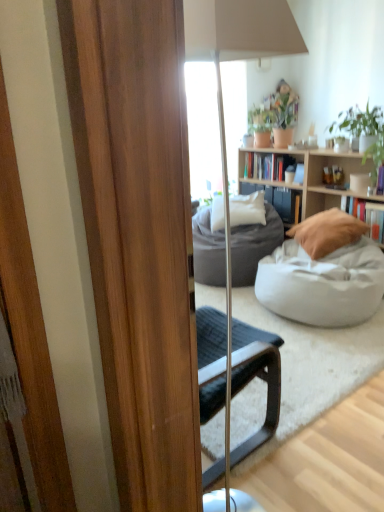
Image resolution: width=384 pixels, height=512 pixels. I want to click on matte beige lamp at center, so pyautogui.click(x=222, y=98).

What do you see at coordinates (366, 215) in the screenshot?
I see `hardcover book at right, which is the second book from back to front` at bounding box center [366, 215].

Describe the element at coordinates (247, 209) in the screenshot. The image size is (384, 512). I see `white soft pillow at center, the 1th pillow in the left-to-right sequence` at that location.

Image resolution: width=384 pixels, height=512 pixels. I want to click on green matte plant at upper right, so point(364,131).

Identify the location of dark gray fabric studio couch at center, the 1th studio couch viewed from the back. This screenshot has width=384, height=512. 254,246.

The width and height of the screenshot is (384, 512). Find the location of `matte beige lamp at center`. matte beige lamp at center is located at coordinates (222, 98).

Which point is more distant from viewer, (345, 172) or (239, 210)?

The point (345, 172) is farther from the camera.

From the image's perspective, which object appears higher, light wood bookcase at center or white soft pillow at center, marked as the 1th pillow in a back-to-front arrangement?

From the image's view, light wood bookcase at center is above.

Can you confirm if light wood bookcase at center is positioned to the left of white soft pillow at center, the 1th pillow in the left-to-right sequence?

No, light wood bookcase at center is not to the left of white soft pillow at center, the 1th pillow in the left-to-right sequence.

From the image's perspective, is dark gray fabric studio couch at center, the 1th studio couch viewed from the back, located above or below white soft pillow at center, marked as the 1th pillow in a back-to-front arrangement?

Based on their image positions, dark gray fabric studio couch at center, the 1th studio couch viewed from the back, is located beneath white soft pillow at center, marked as the 1th pillow in a back-to-front arrangement.

Is white soft pillow at center, the 1th pillow in the left-to-right sequence, at the back of dark gray fabric studio couch at center, the 1th studio couch viewed from the back?

dark gray fabric studio couch at center, the 1th studio couch viewed from the back, does not have its back to white soft pillow at center, the 1th pillow in the left-to-right sequence.

Is dark gray fabric studio couch at center, the 1th studio couch viewed from the back, thinner than white soft pillow at center, the 2th pillow when ordered from right to left?

Incorrect, the width of dark gray fabric studio couch at center, the 1th studio couch viewed from the back, is not less than that of white soft pillow at center, the 2th pillow when ordered from right to left.

Does point (242, 263) come in front of point (238, 206)?

Yes, point (242, 263) is in front of point (238, 206).

Is beige fabric pillow at center-right, arranged as the first pillow when viewed from the right, taller than light wood bookcase at center?

In fact, beige fabric pillow at center-right, arranged as the first pillow when viewed from the right, may be shorter than light wood bookcase at center.

Who is smaller, beige fabric pillow at center-right, arranged as the first pillow when viewed from the right, or light wood bookcase at center?

beige fabric pillow at center-right, arranged as the first pillow when viewed from the right.

Considering the relative positions of beige fabric pillow at center-right, the 1th pillow viewed from the front, and light wood bookcase at center in the image provided, is beige fabric pillow at center-right, the 1th pillow viewed from the front, behind light wood bookcase at center?

That is True.

Is beige fabric pillow at center-right, the 2th pillow viewed from the left, inside the boundaries of light wood bookcase at center, or outside?

beige fabric pillow at center-right, the 2th pillow viewed from the left, exists outside the volume of light wood bookcase at center.

I want to click on the 1st book to the right of the dark gray fabric studio couch at center, which is the second studio couch from front to back, starting your count from the anchor, so click(x=265, y=165).

From a real-world perspective, which is physically above, hardcover books at center, which is the 2th book from front to back, or dark gray fabric studio couch at center, the 1th studio couch viewed from the back?

hardcover books at center, which is the 2th book from front to back.

Relative to dark gray fabric studio couch at center, which is the second studio couch from front to back, is hardcover books at center, positioned as the first book in back-to-front order, in front or behind?

hardcover books at center, positioned as the first book in back-to-front order, is behind dark gray fabric studio couch at center, which is the second studio couch from front to back.

From the image's perspective, does hardcover books at center, which is the 2th book from front to back, appear lower than dark gray fabric studio couch at center, the 1th studio couch viewed from the back?

No.

Which is correct: light wood bookcase at center is inside green matte plant at upper right, or outside of it?

light wood bookcase at center exists outside the volume of green matte plant at upper right.

Between light wood bookcase at center and green matte plant at upper right, which one has smaller width?

With smaller width is green matte plant at upper right.

In the scene shown: From the image's perspective, which is above, light wood bookcase at center or green matte plant at upper right?

green matte plant at upper right is shown above in the image.

Between light wood bookcase at center and green matte plant at upper right, which one appears on the left side from the viewer's perspective?

light wood bookcase at center is more to the left.

Is white soft pillow at center, positioned as the 2th pillow in front-to-back order, inside the boundaries of beige fabric pillow at center-right, arranged as the first pillow when viewed from the right, or outside?

white soft pillow at center, positioned as the 2th pillow in front-to-back order, is spatially situated outside beige fabric pillow at center-right, arranged as the first pillow when viewed from the right.

Could you tell me if white soft pillow at center, positioned as the 2th pillow in front-to-back order, is facing beige fabric pillow at center-right, the 1th pillow viewed from the front?

No, white soft pillow at center, positioned as the 2th pillow in front-to-back order, is not aimed at beige fabric pillow at center-right, the 1th pillow viewed from the front.

Between white soft pillow at center, the 2th pillow when ordered from right to left, and beige fabric pillow at center-right, the 2th pillow viewed from the left, which one appears on the left side from the viewer's perspective?

Positioned to the left is white soft pillow at center, the 2th pillow when ordered from right to left.

From a real-world perspective, which object stands above the other?

white soft pillow at center, the 2th pillow when ordered from right to left, is physically above.

Is matte beige lamp at center in contact with hardcover book at right, the second book from the top?

They are not placed beside each other.

Is matte beige lamp at center positioned behind hardcover book at right, which is the second book from back to front?

No, it is not.

Which object is positioned more to the right, matte beige lamp at center or hardcover book at right, the second book from the top?

hardcover book at right, the second book from the top.

Considering the sizes of matte beige lamp at center and hardcover book at right, the second book from the top, in the image, is matte beige lamp at center wider or thinner than hardcover book at right, the second book from the top,?

Clearly, matte beige lamp at center has more width compared to hardcover book at right, the second book from the top.

Where is `bookcase that is above the white soft pillow at center, marked as the 1th pillow in a back-to-front arrangement (from a real-world perspective)`? bookcase that is above the white soft pillow at center, marked as the 1th pillow in a back-to-front arrangement (from a real-world perspective) is located at coordinates (307, 184).

Identify the location of the 1st pillow to the right of the dark gray fabric studio couch at center, the 1th studio couch viewed from the back, starting your count from the anchor. Image resolution: width=384 pixels, height=512 pixels. (247, 209).

From the picture: From the image, which object appears to be nearer to green matte plant at upper right, beige fabric pillow at center-right, the second pillow in the back-to-front sequence, or white soft pillow at center, the 2th pillow when ordered from right to left?

The object closer to green matte plant at upper right is beige fabric pillow at center-right, the second pillow in the back-to-front sequence.

When comparing their distances from green matte plant at upper right, does hardcover book at right, positioned as the 2th book in left-to-right order, or matte beige lamp at center seem closer?

hardcover book at right, positioned as the 2th book in left-to-right order, is positioned closer to the anchor green matte plant at upper right.

Estimate the real-world distances between objects in this image. Which object is closer to green matte plant at upper right, hardcover books at center, the 2th book in the right-to-left sequence, or beige fabric pillow at center-right, arranged as the first pillow when viewed from the right?

beige fabric pillow at center-right, arranged as the first pillow when viewed from the right.

When comparing their distances from beige fabric pillow at center-right, the 2th pillow viewed from the left, does dark gray fabric studio couch at center, which is the second studio couch from front to back, or green matte plant at upper right seem closer?

dark gray fabric studio couch at center, which is the second studio couch from front to back.

When comparing their distances from matte beige lamp at center, does hardcover book at right, the second book from the top, or green matte plant at upper right seem closer?

green matte plant at upper right.

Estimate the real-world distances between objects in this image. Which object is closer to white soft pillow at center, marked as the 1th pillow in a back-to-front arrangement, green matte plant at upper right or light wood bookcase at center?

The object closer to white soft pillow at center, marked as the 1th pillow in a back-to-front arrangement, is light wood bookcase at center.

Estimate the real-world distances between objects in this image. Which object is further from white fabric bean bag at center, the first studio couch viewed from the front, green matte plant at upper right or matte beige lamp at center?

matte beige lamp at center is positioned further to the anchor white fabric bean bag at center, the first studio couch viewed from the front.

From the image, which object appears to be nearer to hardcover books at center, the 2th book in the right-to-left sequence, beige fabric pillow at center-right, arranged as the first pillow when viewed from the right, or matte beige lamp at center?

The object closer to hardcover books at center, the 2th book in the right-to-left sequence, is beige fabric pillow at center-right, arranged as the first pillow when viewed from the right.

At what (x,y) coordinates should I click in order to perform the action: click on pillow between matte beige lamp at center and dark gray fabric studio couch at center, the 1th studio couch viewed from the back, along the z-axis. Please return your answer as a coordinate pair (x, y). Image resolution: width=384 pixels, height=512 pixels. Looking at the image, I should click on (327, 232).

You are a GUI agent. You are given a task and a screenshot of the screen. Output one action in this format:
    pyautogui.click(x=<x>, y=<y>)
    Task: Click on the bookcase located between matte beige lamp at center and white soft pillow at center, the 2th pillow when ordered from right to left, in the depth direction
    This screenshot has height=512, width=384.
    Given the screenshot: What is the action you would take?
    pyautogui.click(x=307, y=184)

Locate an element on the screen. studio couch between matte beige lamp at center and dark gray fabric studio couch at center, the 1th studio couch viewed from the back, along the z-axis is located at coordinates (324, 272).

At what (x,y) coordinates should I click in order to perform the action: click on book between matte beige lamp at center and green matte plant at upper right along the z-axis. Please return your answer as a coordinate pair (x, y). The image size is (384, 512). Looking at the image, I should click on (366, 215).